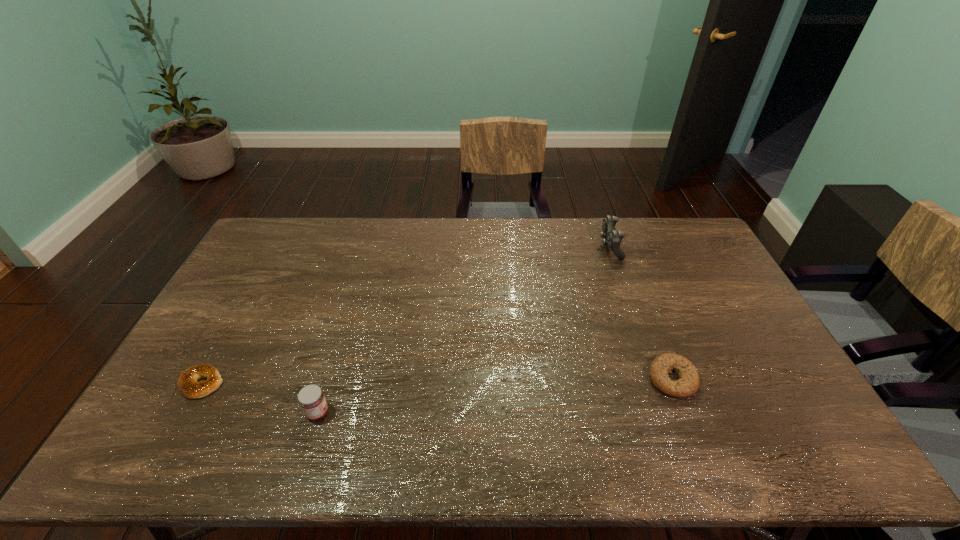
The height and width of the screenshot is (540, 960). What are the coordinates of `vacant space that's between the second object from left to right and the right bagel` in the screenshot? It's located at (494, 396).

At what (x,y) coordinates should I click in order to perform the action: click on vacant area that lies between the farthest object and the taller bagel. Please return your answer as a coordinate pair (x, y). Looking at the image, I should click on (641, 313).

Locate which object ranks second in proximity to the second tallest object. Please provide its 2D coordinates. Your answer should be formatted as a tuple, i.e. [(x, y)], where the tuple contains the x and y coordinates of a point satisfying the conditions above.

[(687, 385)]

Where is `the second closest object relative to the right bagel`? The image size is (960, 540). the second closest object relative to the right bagel is located at coordinates (311, 398).

Where is `vacant space that satisfies the following two spatial constraints: 1. on the back side of the taller bagel; 2. on the surface of the tallest object with buttons`? Image resolution: width=960 pixels, height=540 pixels. vacant space that satisfies the following two spatial constraints: 1. on the back side of the taller bagel; 2. on the surface of the tallest object with buttons is located at coordinates (621, 247).

The width and height of the screenshot is (960, 540). Find the location of `blank area in the image that satisfies the following two spatial constraints: 1. on the surface of the control with buttons; 2. on the front side of the jam`. blank area in the image that satisfies the following two spatial constraints: 1. on the surface of the control with buttons; 2. on the front side of the jam is located at coordinates [668, 413].

This screenshot has height=540, width=960. In order to click on vacant point that satisfies the following two spatial constraints: 1. on the surface of the control with buttons; 2. on the front side of the third object from right to left in this screenshot , I will do `click(668, 413)`.

Locate an element on the screen. The height and width of the screenshot is (540, 960). vacant space that satisfies the following two spatial constraints: 1. on the surface of the control with buttons; 2. on the front side of the nearest object is located at coordinates [668, 413].

The height and width of the screenshot is (540, 960). Identify the location of blank area in the image that satisfies the following two spatial constraints: 1. on the surface of the farthest object with buttons; 2. on the front side of the nearest object. (668, 413).